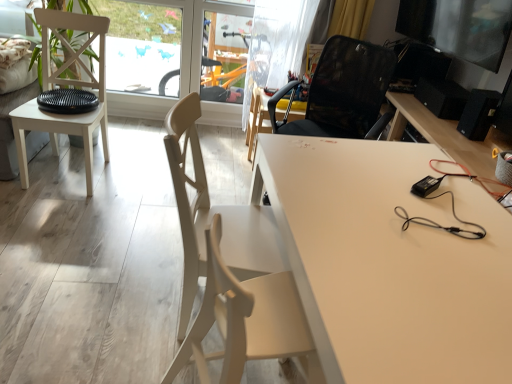
Question: From a real-world perspective, is transparent plastic window screen at upper left located higher than black matte speaker at right?

Choices:
 (A) yes
 (B) no

Answer: (B)

Question: From a real-world perspective, is transparent plastic window screen at upper left physically below black matte speaker at right?

Choices:
 (A) no
 (B) yes

Answer: (B)

Question: Is transparent plastic window screen at upper left in contact with black matte speaker at right?

Choices:
 (A) yes
 (B) no

Answer: (B)

Question: Is transparent plastic window screen at upper left shorter than black matte speaker at right?

Choices:
 (A) no
 (B) yes

Answer: (A)

Question: Does transparent plastic window screen at upper left have a larger size compared to black matte speaker at right?

Choices:
 (A) yes
 (B) no

Answer: (A)

Question: Does transparent plastic window screen at upper left have a lesser width compared to black matte speaker at right?

Choices:
 (A) yes
 (B) no

Answer: (A)

Question: Does transparent plastic screen door at upper center have a lesser width compared to matte white chair at center, marked as the third chair in a back-to-front arrangement?

Choices:
 (A) no
 (B) yes

Answer: (B)

Question: Does transparent plastic screen door at upper center have a larger size compared to matte white chair at center, which ranks as the 2th chair in front-to-back order?

Choices:
 (A) no
 (B) yes

Answer: (A)

Question: Considering the relative positions of transparent plastic screen door at upper center and matte white chair at center, which ranks as the 2th chair in front-to-back order, in the image provided, is transparent plastic screen door at upper center to the right of matte white chair at center, which ranks as the 2th chair in front-to-back order, from the viewer's perspective?

Choices:
 (A) yes
 (B) no

Answer: (B)

Question: Is transparent plastic screen door at upper center far from matte white chair at center, which ranks as the 2th chair in front-to-back order?

Choices:
 (A) no
 (B) yes

Answer: (B)

Question: Is the surface of transparent plastic screen door at upper center in direct contact with matte white chair at center, marked as the third chair in a back-to-front arrangement?

Choices:
 (A) no
 (B) yes

Answer: (A)

Question: Is transparent plastic screen door at upper center turned away from matte white chair at center, which ranks as the 2th chair in front-to-back order?

Choices:
 (A) yes
 (B) no

Answer: (B)

Question: Is black matte speaker at right further to the viewer compared to transparent plastic screen door at upper center?

Choices:
 (A) yes
 (B) no

Answer: (B)